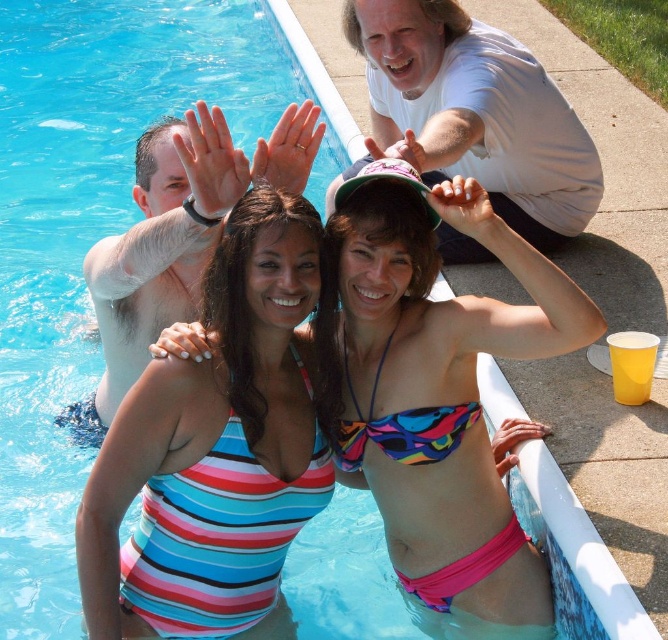
Does smooth skin man at left appear over striped fabric bikini at center?

Indeed, smooth skin man at left is positioned over striped fabric bikini at center.

Is smooth skin man at left smaller than striped fabric bikini at center?

Actually, smooth skin man at left might be larger than striped fabric bikini at center.

This screenshot has height=640, width=668. In order to click on smooth skin man at left in this screenshot , I will do `click(176, 237)`.

Where is `smooth skin man at left`? This screenshot has height=640, width=668. smooth skin man at left is located at coordinates (176, 237).

Can you confirm if white cotton shirt at upper center is wider than multicolored printed bikini top at center?

Yes.

Which of these two, white cotton shirt at upper center or multicolored printed bikini top at center, stands shorter?

Standing shorter between the two is multicolored printed bikini top at center.

Find the location of a particular element. This screenshot has height=640, width=668. white cotton shirt at upper center is located at coordinates (476, 113).

Where is `white cotton shirt at upper center`? The width and height of the screenshot is (668, 640). white cotton shirt at upper center is located at coordinates (476, 113).

Does white cotton shirt at upper center have a lesser width compared to multicolored fabric bikini at center?

Incorrect, white cotton shirt at upper center's width is not less than multicolored fabric bikini at center's.

Who is higher up, white cotton shirt at upper center or multicolored fabric bikini at center?

white cotton shirt at upper center

Identify the location of white cotton shirt at upper center. (476, 113).